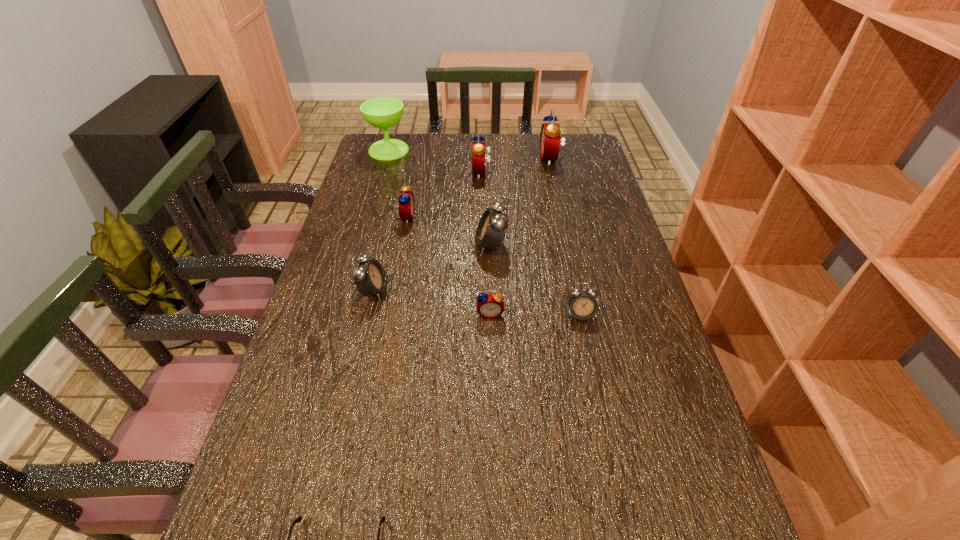
Identify the location of the smallest red alarm clock. (490, 306).

The height and width of the screenshot is (540, 960). Find the location of `the smallest white alarm clock`. the smallest white alarm clock is located at coordinates (582, 303).

This screenshot has height=540, width=960. I want to click on the rightmost white alarm clock, so click(582, 303).

Locate an element on the screen. This screenshot has width=960, height=540. vacant space located on the front-facing side of the rightmost red alarm clock is located at coordinates (442, 159).

The width and height of the screenshot is (960, 540). What are the coordinates of `vacant space situated 0.320m on the front-facing side of the rightmost red alarm clock` in the screenshot? It's located at (452, 159).

What are the coordinates of `free space located on the front-facing side of the rightmost red alarm clock` in the screenshot? It's located at (439, 159).

This screenshot has width=960, height=540. Find the location of `free region located 0.060m on the front of the green wineglass`. free region located 0.060m on the front of the green wineglass is located at coordinates (383, 169).

Find the location of a particular element. This screenshot has width=960, height=540. blank space located 0.160m on the front-facing side of the second biggest red alarm clock is located at coordinates pyautogui.click(x=426, y=173).

At what (x,y) coordinates should I click in order to perform the action: click on blank space located on the front-facing side of the second biggest red alarm clock. Please return your answer as a coordinate pair (x, y). Looking at the image, I should click on (395, 173).

Locate an element on the screen. The width and height of the screenshot is (960, 540). vacant point located 0.250m on the front-facing side of the second biggest red alarm clock is located at coordinates (400, 173).